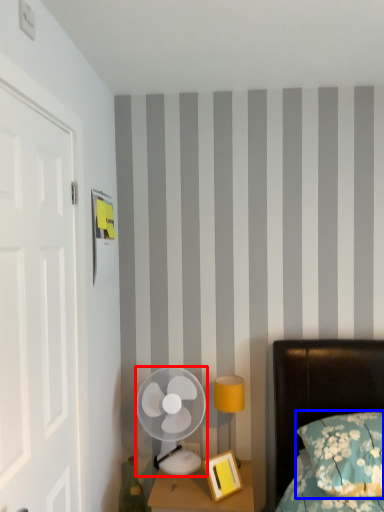
Question: Which point is closer to the camera, mechanical fan (highlighted by a red box) or pillow (highlighted by a blue box)?

Choices:
 (A) mechanical fan
 (B) pillow

Answer: (B)